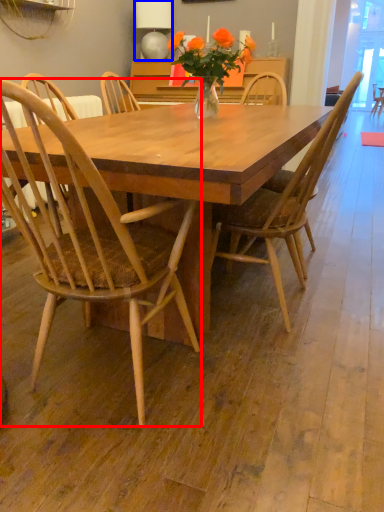
Question: Which point is further to the camera, chair (highlighted by a red box) or lamp (highlighted by a blue box)?

Choices:
 (A) chair
 (B) lamp

Answer: (B)